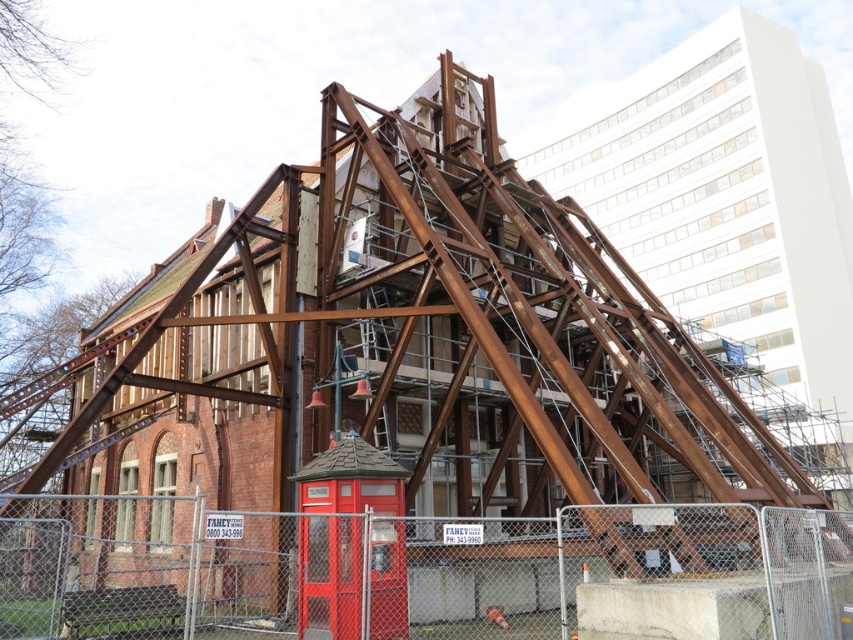
Could you measure the distance between metal chain-link fence at lower center and matte red telephone box at lower center?

A distance of 2.24 meters exists between metal chain-link fence at lower center and matte red telephone box at lower center.

Describe the element at coordinates (396, 568) in the screenshot. This screenshot has width=853, height=640. I see `metal chain-link fence at lower center` at that location.

Does point (732, 602) come in front of point (393, 563)?

Yes, it is in front of point (393, 563).

Find the location of `metal chain-link fence at lower center`. metal chain-link fence at lower center is located at coordinates (396, 568).